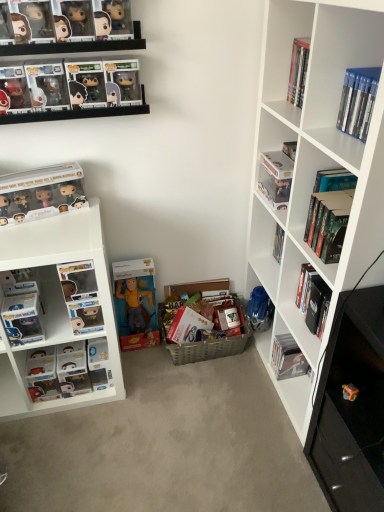
Measure the distance between matte plastic pop vinyl figure at upper right, placed as the 3th book when sorted from left to right, and camera.

The depth of matte plastic pop vinyl figure at upper right, placed as the 3th book when sorted from left to right, is 1.52 meters.

Measure the distance between point (307,41) and camera.

Point (307,41) and camera are 1.47 meters apart.

What do you see at coordinates (59, 372) in the screenshot?
I see `matte plastic pop vinyl figure at lower left, placed as the 7th book when sorted from right to left` at bounding box center [59, 372].

The height and width of the screenshot is (512, 384). What do you see at coordinates (358, 101) in the screenshot? I see `blue hardcover book at upper right, which is the 6th book from left to right` at bounding box center [358, 101].

Find the location of `white plastic shelves at left`. white plastic shelves at left is located at coordinates (58, 306).

Is white matte bookshelf at right beside woven brown basket at center?

No, white matte bookshelf at right is not beside woven brown basket at center.

Between point (341, 17) and point (189, 361), which one is positioned behind?

The point (189, 361) is more distant.

From the image's perspective, who appears lower, white matte bookshelf at right or woven brown basket at center?

From the image's view, woven brown basket at center is below.

Which of these two, white matte bookshelf at right or woven brown basket at center, is bigger?

With larger size is white matte bookshelf at right.

Between point (266, 182) and point (33, 398), which one is positioned behind?

The point (33, 398) is farther from the camera.

In the scene shown: Which object is positioned more to the right, matte plastic pop vinyl figure at upper right, which is counted as the sixth book, starting from the right, or matte plastic pop vinyl figure at lower left, placed as the 7th book when sorted from right to left?

matte plastic pop vinyl figure at upper right, which is counted as the sixth book, starting from the right.

From a real-world perspective, who is located lower, matte plastic pop vinyl figure at upper right, which is counted as the sixth book, starting from the right, or matte plastic pop vinyl figure at lower left, placed as the 7th book when sorted from right to left?

matte plastic pop vinyl figure at lower left, placed as the 7th book when sorted from right to left, is physically lower.

Is matte plastic pop vinyl figure at upper right, which is counted as the sixth book, starting from the right, facing away from matte plastic pop vinyl figure at lower left, placed as the 7th book when sorted from right to left?

matte plastic pop vinyl figure at upper right, which is counted as the sixth book, starting from the right, is not turned away from matte plastic pop vinyl figure at lower left, placed as the 7th book when sorted from right to left.

Can you confirm if matte black pop vinyl figures at upper left, which is the first book in left-to-right order, is wider than hardcover book at upper right, which ranks as the 8th book in left-to-right order?

Incorrect, the width of matte black pop vinyl figures at upper left, which is the first book in left-to-right order, does not surpass that of hardcover book at upper right, which ranks as the 8th book in left-to-right order.

Does point (5, 219) appear closer or farther from the camera than point (352, 188)?

Clearly, point (5, 219) is more distant from the camera than point (352, 188).

You are a GUI agent. You are given a task and a screenshot of the screen. Output one action in this format:
    pyautogui.click(x=<x>, y=<y>)
    Task: Click on the 3rd book in front of the matte black pop vinyl figures at upper left, the eighth book when ordered from right to left, starting your count from the anchor
    
    Given the screenshot: What is the action you would take?
    [329, 213]

Based on the photo, is matte black pop vinyl figures at upper left, which is the first book in left-to-right order, touching hardcover book at upper right, which ranks as the 8th book in left-to-right order?

matte black pop vinyl figures at upper left, which is the first book in left-to-right order, is not next to hardcover book at upper right, which ranks as the 8th book in left-to-right order, and they're not touching.

Can you confirm if black matte book at lower right, positioned as the 2th book in right-to-left order, is taller than white plastic shelves at left?

No, black matte book at lower right, positioned as the 2th book in right-to-left order, is not taller than white plastic shelves at left.

This screenshot has width=384, height=512. I want to click on bookshelf below the black matte book at lower right, positioned as the 2th book in right-to-left order (from a real-world perspective), so click(58, 306).

From the image's perspective, is black matte book at lower right, which appears as the seventh book when viewed from the left, positioned above or below white plastic shelves at left?

Based on their image positions, black matte book at lower right, which appears as the seventh book when viewed from the left, is located above white plastic shelves at left.

Which object is positioned more to the left, black matte book at lower right, which appears as the seventh book when viewed from the left, or white plastic shelves at left?

Positioned to the left is white plastic shelves at left.

Is matte black pop vinyl figures at upper left, the eighth book when ordered from right to left, touching translucent plastic cube at lower right, the 2th toy viewed from the left?

No, matte black pop vinyl figures at upper left, the eighth book when ordered from right to left, is not with translucent plastic cube at lower right, the 2th toy viewed from the left.

Is point (33, 204) closer to viewer compared to point (354, 393)?

That is False.

Considering the sizes of objects matte black pop vinyl figures at upper left, which is the first book in left-to-right order, and translucent plastic cube at lower right, which ranks as the 1th toy in right-to-left order, in the image provided, who is thinner, matte black pop vinyl figures at upper left, which is the first book in left-to-right order, or translucent plastic cube at lower right, which ranks as the 1th toy in right-to-left order,?

translucent plastic cube at lower right, which ranks as the 1th toy in right-to-left order, is thinner.

From the image's perspective, starting from the translucent plastic cube at lower right, the 2th toy viewed from the left, which book is the 3rd one above? Please provide its 2D coordinates.

[(41, 193)]

Considering the positions of objects woven brown basket at center and matte plastic pop vinyl figure at upper right, placed as the 3th book when sorted from left to right, in the image provided, who is behind, woven brown basket at center or matte plastic pop vinyl figure at upper right, placed as the 3th book when sorted from left to right,?

woven brown basket at center.

Is point (209, 346) positioned behind point (262, 165)?

Yes.

How far apart are woven brown basket at center and matte plastic pop vinyl figure at upper right, placed as the 3th book when sorted from left to right?

27.78 inches.

Is matte black pop vinyl figures at upper left, the eighth book when ordered from right to left, inside or outside of woven brown basket at center?

matte black pop vinyl figures at upper left, the eighth book when ordered from right to left, is outside woven brown basket at center.

Which point is more distant from viewer, (81, 195) or (194, 347)?

The point (194, 347) is behind.

From a real-world perspective, is matte black pop vinyl figures at upper left, the eighth book when ordered from right to left, on top of woven brown basket at center?

Yes.

Is matte black pop vinyl figures at upper left, the eighth book when ordered from right to left, aimed at woven brown basket at center?

No, matte black pop vinyl figures at upper left, the eighth book when ordered from right to left, is not oriented towards woven brown basket at center.

The height and width of the screenshot is (512, 384). In order to click on shelf lying above the woven brown basket at center (from the image's perspective) in this screenshot , I will do `click(315, 167)`.

Locate an element on the screen. The height and width of the screenshot is (512, 384). the 1st book counting from the left of the matte plastic pop vinyl figure at upper right, which is counted as the sixth book, starting from the right is located at coordinates (59, 372).

Looking at the image, which one is located further to matte black figurine at upper left, which ranks as the first toy in top-to-bottom order, white matte bookshelf at right or hardcover book at upper right, the first book when ordered from right to left?

white matte bookshelf at right is further to matte black figurine at upper left, which ranks as the first toy in top-to-bottom order.

Looking at the image, which one is located further to matte black figurine at upper left, which appears as the 2th toy when ordered from the bottom, blue hardcover book at upper right, the third book when ordered from right to left, or hardcover book at upper right, the first book when ordered from right to left?

hardcover book at upper right, the first book when ordered from right to left, lies further to matte black figurine at upper left, which appears as the 2th toy when ordered from the bottom, than the other object.

Looking at the image, which one is located further to woven brown basket at center, matte black figurine at upper left, which ranks as the 2th toy in right-to-left order, or hardcover book at upper right, the first book when ordered from right to left?

matte black figurine at upper left, which ranks as the 2th toy in right-to-left order, is positioned further to the anchor woven brown basket at center.

Considering their positions, is hardcover book at upper right, which ranks as the 8th book in left-to-right order, positioned closer to matte plastic pop vinyl figure at lower left, placed as the 7th book when sorted from right to left, than woven brown basket at center?

woven brown basket at center is closer to matte plastic pop vinyl figure at lower left, placed as the 7th book when sorted from right to left.

Considering their positions, is white matte bookshelf at right positioned closer to matte black pop vinyl figures at upper left, the eighth book when ordered from right to left, than matte plastic pop vinyl figure at lower left, the second book from the left?

Based on the image, matte plastic pop vinyl figure at lower left, the second book from the left, appears to be nearer to matte black pop vinyl figures at upper left, the eighth book when ordered from right to left.

From the image, which object appears to be nearer to matte black pop vinyl figures at upper left, which is the first book in left-to-right order, white matte bookshelf at right or hardcover book at lower right, the fourth book positioned from the right?

Based on the image, white matte bookshelf at right appears to be nearer to matte black pop vinyl figures at upper left, which is the first book in left-to-right order.

Consider the image. Considering their positions, is matte plastic pop vinyl figure at lower left, placed as the 7th book when sorted from right to left, positioned closer to matte black pop vinyl figures at upper left, which is the first book in left-to-right order, than hardcover book at upper right, acting as the fourth book starting from the left?

matte plastic pop vinyl figure at lower left, placed as the 7th book when sorted from right to left.

Looking at the image, which one is located closer to woven brown basket at center, blue hardcover book at upper right, the third book when ordered from right to left, or matte plastic pop vinyl figure at lower left, the second book from the left?

matte plastic pop vinyl figure at lower left, the second book from the left, is positioned closer to the anchor woven brown basket at center.

Locate an element on the screen. The image size is (384, 512). toy between matte black figurine at upper left, which ranks as the 2th toy in right-to-left order, and hardcover book at lower right, the fourth book positioned from the right, in the up-down direction is located at coordinates (350, 392).

This screenshot has width=384, height=512. What are the coordinates of `basket that lies between hardcover book at upper right, which appears as the 5th book when viewed from the right, and hardcover book at lower right, the 5th book when ordered from left to right, from top to bottom` in the screenshot? It's located at (212, 344).

In order to click on basket between white plastic shelves at left and hardcover book at upper right, the first book when ordered from right to left, in the horizontal direction in this screenshot , I will do `click(212, 344)`.

Where is `basket between matte black pop vinyl figures at upper left, which is the first book in left-to-right order, and hardcover book at upper right, acting as the fourth book starting from the left, from left to right`? Image resolution: width=384 pixels, height=512 pixels. basket between matte black pop vinyl figures at upper left, which is the first book in left-to-right order, and hardcover book at upper right, acting as the fourth book starting from the left, from left to right is located at coordinates (212, 344).